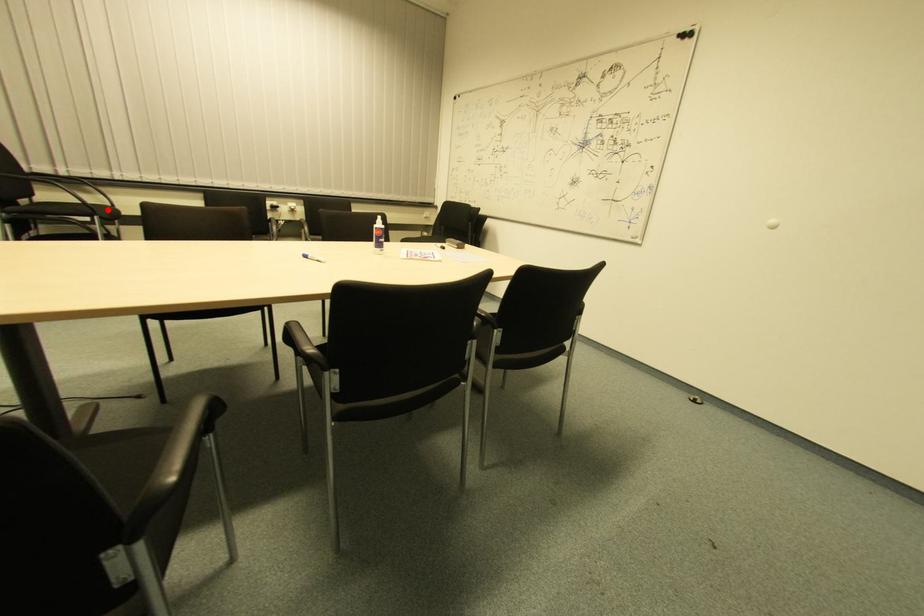
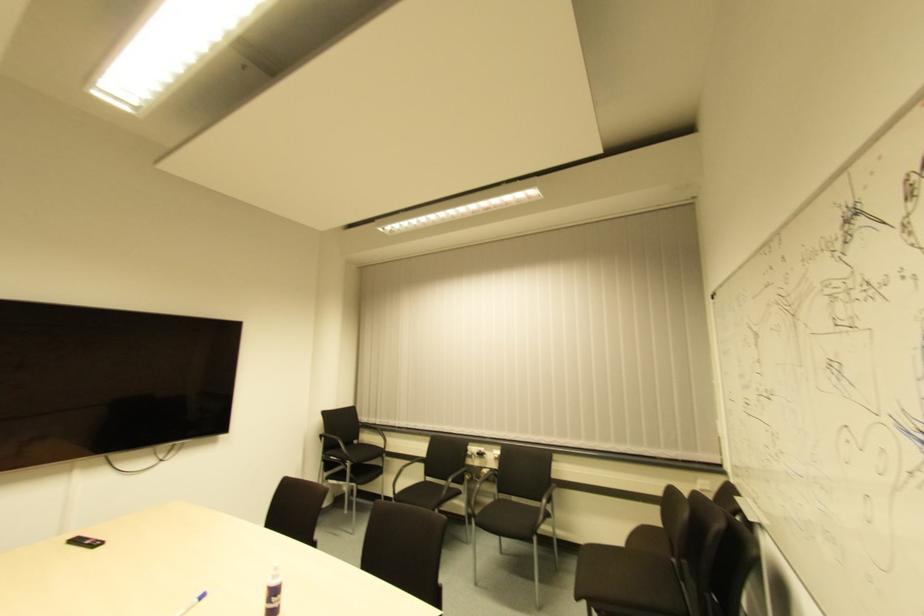
Question: I am providing you with two images of the same scene from different viewpoints. Image1 has a red point marked. In image2, the corresponding 3D location appears at what relative position? Reply with the corresponding letter.

Choices:
 (A) Closer
 (B) Farther

Answer: (B)